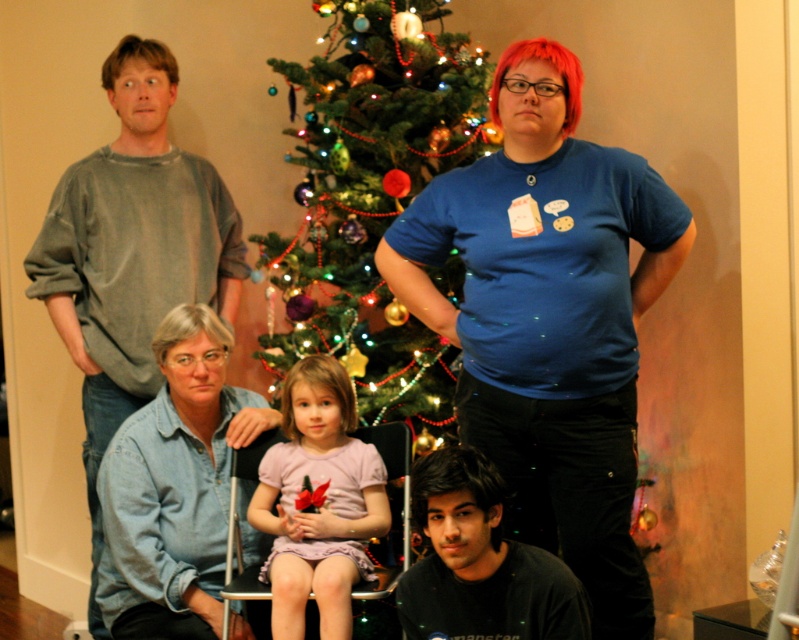
You are standing in the living room and want to place a small gift box between the two points labeled point [156,289] and point [454,573]. Which point is closer to you so you can start placing the gift box there?

Point [156,289] is closer to you than point [454,573], so you should start placing the gift box near point [156,289].

You are taking a family photo and need to arrange the gray cotton shirt at upper left and the black matte shirt at lower center so that they are aligned properly. According to the current setup, which shirt is positioned to the left of the other?

The gray cotton shirt at upper left is positioned on the left side of black matte shirt at lower center.